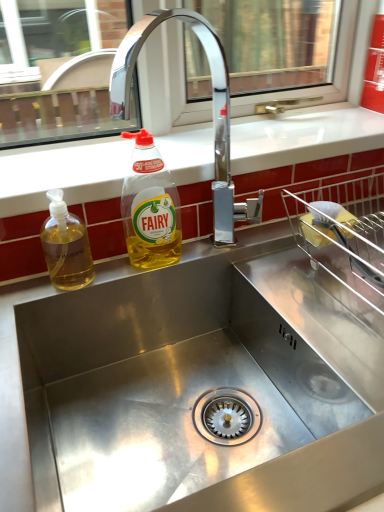
This screenshot has width=384, height=512. Describe the element at coordinates (150, 207) in the screenshot. I see `yellow translucent liquid at upper center, which is counted as the second bottle, starting from the left` at that location.

The image size is (384, 512). I want to click on chrome metallic faucet at upper center, so click(213, 112).

Where is `translucent yellow liquid at sink left, the 2th bottle when ordered from right to left`? This screenshot has width=384, height=512. translucent yellow liquid at sink left, the 2th bottle when ordered from right to left is located at coordinates (66, 246).

This screenshot has height=512, width=384. Find the location of `white glossy countertop at upper center`. white glossy countertop at upper center is located at coordinates (303, 136).

The image size is (384, 512). Find the location of `yellow translucent liquid at upper center, which is counted as the second bottle, starting from the left`. yellow translucent liquid at upper center, which is counted as the second bottle, starting from the left is located at coordinates click(x=150, y=207).

Is white glossy countertop at upper center smaller than yellow translucent liquid at upper center, which is counted as the second bottle, starting from the left?

Actually, white glossy countertop at upper center might be larger than yellow translucent liquid at upper center, which is counted as the second bottle, starting from the left.

From a real-world perspective, which object rests below the other?

In real-world perspective, yellow translucent liquid at upper center, which is counted as the second bottle, starting from the left, is lower.

Who is shorter, white glossy countertop at upper center or yellow translucent liquid at upper center, positioned as the first bottle in right-to-left order?

white glossy countertop at upper center.

Consider the image. Can you confirm if white glossy countertop at upper center is wider than yellow translucent liquid at upper center, which is counted as the second bottle, starting from the left?

Indeed, white glossy countertop at upper center has a greater width compared to yellow translucent liquid at upper center, which is counted as the second bottle, starting from the left.

Which of these two, chrome metallic faucet at upper center or translucent yellow liquid at sink left, the 2th bottle when ordered from right to left, is wider?

chrome metallic faucet at upper center is wider.

Is chrome metallic faucet at upper center positioned with its back to translucent yellow liquid at sink left, the 2th bottle when ordered from right to left?

chrome metallic faucet at upper center is not turned away from translucent yellow liquid at sink left, the 2th bottle when ordered from right to left.

Is the position of chrome metallic faucet at upper center less distant than that of translucent yellow liquid at sink left, which is counted as the first bottle, starting from the left?

Yes, it is.

Is white glossy countertop at upper center turned away from translucent yellow liquid at sink left, the 2th bottle when ordered from right to left?

That's not correct — white glossy countertop at upper center is not looking away from translucent yellow liquid at sink left, the 2th bottle when ordered from right to left.

Are white glossy countertop at upper center and translucent yellow liquid at sink left, the 2th bottle when ordered from right to left, far apart?

Actually, white glossy countertop at upper center and translucent yellow liquid at sink left, the 2th bottle when ordered from right to left, are a little close together.

Image resolution: width=384 pixels, height=512 pixels. Find the location of `counter top above the translucent yellow liquid at sink left, which is counted as the first bottle, starting from the left (from a real-world perspective)`. counter top above the translucent yellow liquid at sink left, which is counted as the first bottle, starting from the left (from a real-world perspective) is located at coordinates (303, 136).

From the image's perspective, is white glossy countertop at upper center below translucent yellow liquid at sink left, which is counted as the first bottle, starting from the left?

Incorrect, from the image's perspective, white glossy countertop at upper center is higher than translucent yellow liquid at sink left, which is counted as the first bottle, starting from the left.

From the image's perspective, which object appears higher, yellow translucent liquid at upper center, positioned as the first bottle in right-to-left order, or white glossy countertop at upper center?

From the image's view, white glossy countertop at upper center is above.

Between yellow translucent liquid at upper center, positioned as the first bottle in right-to-left order, and white glossy countertop at upper center, which one has smaller width?

yellow translucent liquid at upper center, positioned as the first bottle in right-to-left order.

Is white glossy countertop at upper center situated inside chrome metallic faucet at upper center or outside?

The correct answer is: outside.

From the image's perspective, is white glossy countertop at upper center above chrome metallic faucet at upper center?

Indeed, from the image's perspective, white glossy countertop at upper center is shown above chrome metallic faucet at upper center.

Is white glossy countertop at upper center aimed at chrome metallic faucet at upper center?

Yes, white glossy countertop at upper center is aimed at chrome metallic faucet at upper center.

I want to click on counter top that is behind the chrome metallic faucet at upper center, so click(x=303, y=136).

Between translucent yellow liquid at sink left, which is counted as the first bottle, starting from the left, and white glossy countertop at upper center, which one has more height?

translucent yellow liquid at sink left, which is counted as the first bottle, starting from the left.

Considering the positions of objects translucent yellow liquid at sink left, the 2th bottle when ordered from right to left, and white glossy countertop at upper center in the image provided, who is behind, translucent yellow liquid at sink left, the 2th bottle when ordered from right to left, or white glossy countertop at upper center?

white glossy countertop at upper center is further away from the camera.

From a real-world perspective, is translucent yellow liquid at sink left, the 2th bottle when ordered from right to left, physically located above or below white glossy countertop at upper center?

Clearly, from a real-world perspective, translucent yellow liquid at sink left, the 2th bottle when ordered from right to left, is below white glossy countertop at upper center.

Which object is closer to the camera taking this photo, translucent yellow liquid at sink left, which is counted as the first bottle, starting from the left, or yellow translucent liquid at upper center, which is counted as the second bottle, starting from the left?

Positioned in front is translucent yellow liquid at sink left, which is counted as the first bottle, starting from the left.

Is translucent yellow liquid at sink left, which is counted as the first bottle, starting from the left, to the left or to the right of yellow translucent liquid at upper center, positioned as the first bottle in right-to-left order, in the image?

In the image, translucent yellow liquid at sink left, which is counted as the first bottle, starting from the left, appears on the left side of yellow translucent liquid at upper center, positioned as the first bottle in right-to-left order.

Considering the relative sizes of translucent yellow liquid at sink left, the 2th bottle when ordered from right to left, and yellow translucent liquid at upper center, positioned as the first bottle in right-to-left order, in the image provided, is translucent yellow liquid at sink left, the 2th bottle when ordered from right to left, smaller than yellow translucent liquid at upper center, positioned as the first bottle in right-to-left order,?

Yes.

Does translucent yellow liquid at sink left, the 2th bottle when ordered from right to left, have a lesser width compared to yellow translucent liquid at upper center, which is counted as the second bottle, starting from the left?

Yes.

Locate an element on the screen. The width and height of the screenshot is (384, 512). bottle that is the 1st one when counting downward from the white glossy countertop at upper center (from the image's perspective) is located at coordinates (150, 207).

Find the location of a particular element. This screenshot has height=512, width=384. tap located in front of the translucent yellow liquid at sink left, the 2th bottle when ordered from right to left is located at coordinates (213, 112).

Estimate the real-world distances between objects in this image. Which object is further from white glossy countertop at upper center, yellow translucent liquid at upper center, positioned as the first bottle in right-to-left order, or chrome metallic faucet at upper center?

chrome metallic faucet at upper center is further to white glossy countertop at upper center.

From the image, which object appears to be nearer to white glossy countertop at upper center, chrome metallic faucet at upper center or translucent yellow liquid at sink left, which is counted as the first bottle, starting from the left?

chrome metallic faucet at upper center.

In the scene shown: When comparing their distances from chrome metallic faucet at upper center, does translucent yellow liquid at sink left, which is counted as the first bottle, starting from the left, or yellow translucent liquid at upper center, positioned as the first bottle in right-to-left order, seem further?

Based on the image, translucent yellow liquid at sink left, which is counted as the first bottle, starting from the left, appears to be further to chrome metallic faucet at upper center.

Considering their positions, is yellow translucent liquid at upper center, which is counted as the second bottle, starting from the left, positioned closer to translucent yellow liquid at sink left, the 2th bottle when ordered from right to left, than chrome metallic faucet at upper center?

yellow translucent liquid at upper center, which is counted as the second bottle, starting from the left, lies closer to translucent yellow liquid at sink left, the 2th bottle when ordered from right to left, than the other object.

Considering their positions, is chrome metallic faucet at upper center positioned closer to yellow translucent liquid at upper center, positioned as the first bottle in right-to-left order, than translucent yellow liquid at sink left, which is counted as the first bottle, starting from the left?

chrome metallic faucet at upper center is closer to yellow translucent liquid at upper center, positioned as the first bottle in right-to-left order.

Based on their spatial positions, is chrome metallic faucet at upper center or yellow translucent liquid at upper center, which is counted as the second bottle, starting from the left, further from white glossy countertop at upper center?

chrome metallic faucet at upper center lies further to white glossy countertop at upper center than the other object.

Which object lies nearer to the anchor point yellow translucent liquid at upper center, which is counted as the second bottle, starting from the left, white glossy countertop at upper center or chrome metallic faucet at upper center?

Among the two, white glossy countertop at upper center is located nearer to yellow translucent liquid at upper center, which is counted as the second bottle, starting from the left.

Looking at the image, which one is located further to yellow translucent liquid at upper center, positioned as the first bottle in right-to-left order, chrome metallic faucet at upper center or white glossy countertop at upper center?

chrome metallic faucet at upper center lies further to yellow translucent liquid at upper center, positioned as the first bottle in right-to-left order, than the other object.

Locate an element on the screen. The height and width of the screenshot is (512, 384). bottle situated between translucent yellow liquid at sink left, the 2th bottle when ordered from right to left, and white glossy countertop at upper center from left to right is located at coordinates (150, 207).

In order to click on tap between translucent yellow liquid at sink left, the 2th bottle when ordered from right to left, and white glossy countertop at upper center in this screenshot , I will do `click(213, 112)`.

Where is `bottle between translucent yellow liquid at sink left, the 2th bottle when ordered from right to left, and chrome metallic faucet at upper center`? The width and height of the screenshot is (384, 512). bottle between translucent yellow liquid at sink left, the 2th bottle when ordered from right to left, and chrome metallic faucet at upper center is located at coordinates (150, 207).